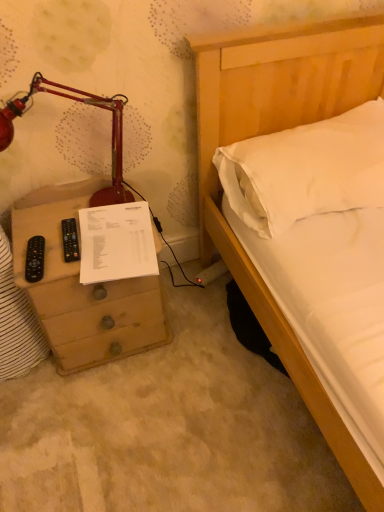
You are a GUI agent. You are given a task and a screenshot of the screen. Output one action in this format:
    pyautogui.click(x=<x>, y=<y>)
    Task: Click on the free spot behind black plastic remote at left
    
    Given the screenshot: What is the action you would take?
    pyautogui.click(x=44, y=224)